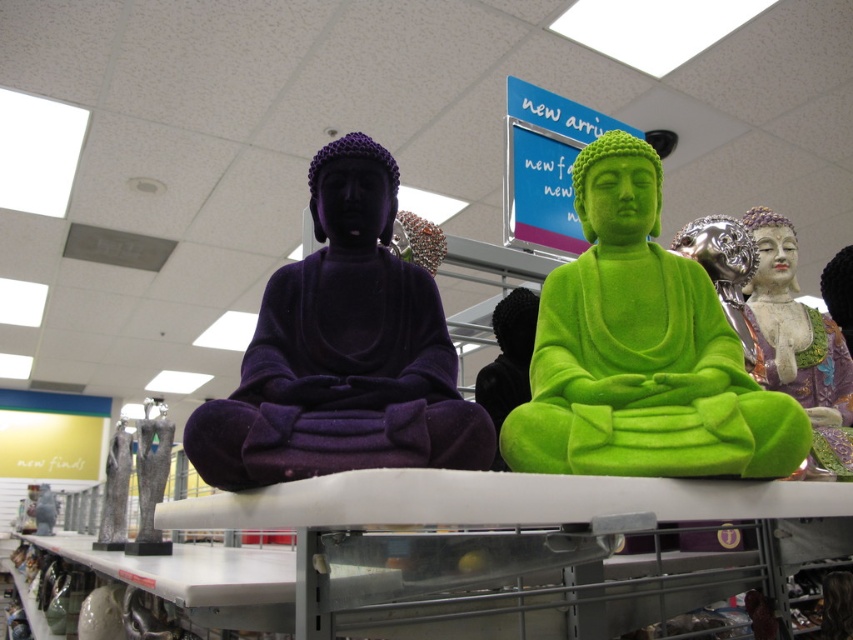
Which of these two, green fuzzy buddha at center or gray marble statue at lower left, stands taller?

gray marble statue at lower left is taller.

Between point (752, 428) and point (142, 504), which one is positioned in front?

Point (752, 428) is in front.

Where is `green fuzzy buddha at center`? Image resolution: width=853 pixels, height=640 pixels. green fuzzy buddha at center is located at coordinates (641, 349).

Is point (260, 445) positioned after point (138, 483)?

That is False.

Is purple velvety monk at center smaller than gray marble statue at lower left?

Incorrect, purple velvety monk at center is not smaller in size than gray marble statue at lower left.

Who is more distant from viewer, (439, 388) or (138, 536)?

Positioned behind is point (138, 536).

What are the coordinates of `purple velvety monk at center` in the screenshot? It's located at (343, 352).

This screenshot has width=853, height=640. I want to click on green fuzzy buddha at center, so click(x=641, y=349).

Who is more forward, (x=804, y=420) or (x=437, y=308)?

Point (x=804, y=420) is in front.

Measure the distance between point (683, 449) and camera.

The distance of point (683, 449) from camera is 26.88 inches.

The height and width of the screenshot is (640, 853). What are the coordinates of `green fuzzy buddha at center` in the screenshot? It's located at (641, 349).